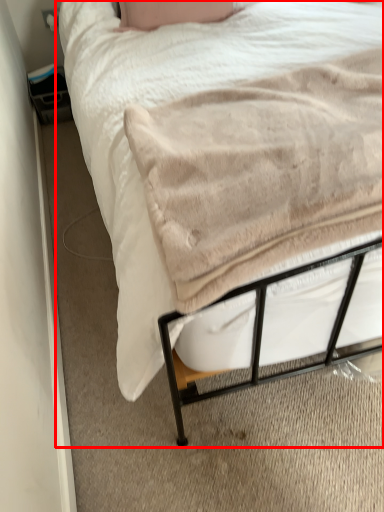
Question: Considering the relative positions of bed (annotated by the red box) and blanket in the image provided, where is bed (annotated by the red box) located with respect to the staircase?

Choices:
 (A) right
 (B) left

Answer: (B)